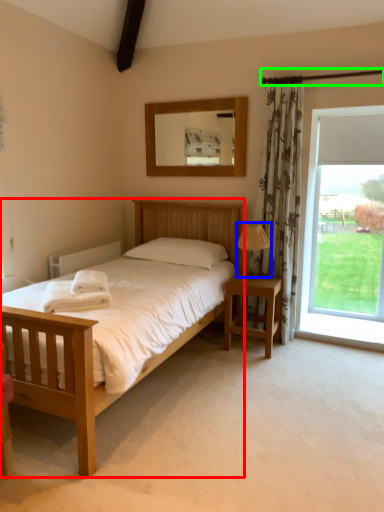
Question: Based on their relative distances, which object is nearer to bed (highlighted by a red box)? Choose from lamp (highlighted by a blue box) and balcony (highlighted by a green box).

Choices:
 (A) lamp
 (B) balcony

Answer: (A)